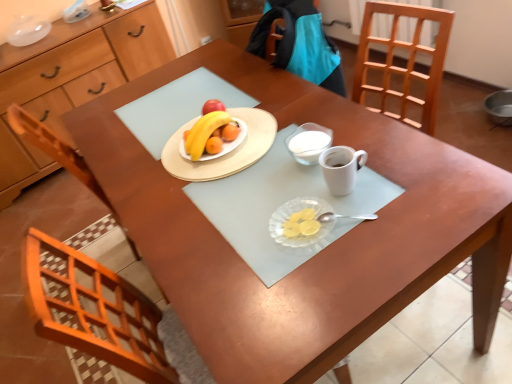
Identify the location of vacant space to the left of yellow matte grapefruit at center. This screenshot has width=512, height=384. (151, 157).